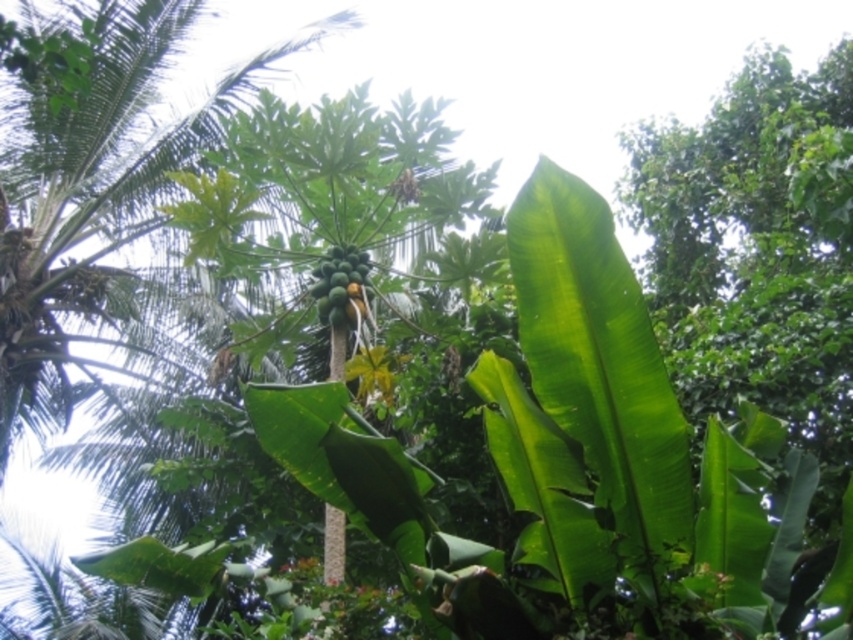
Between green matte coconut tree at center and green matte papaya at center, which one is positioned lower?

green matte papaya at center

Is green matte coconut tree at center shorter than green matte papaya at center?

Indeed, green matte coconut tree at center has a lesser height compared to green matte papaya at center.

Locate an element on the screen. The image size is (853, 640). green matte coconut tree at center is located at coordinates (323, 179).

Is point (120, 29) less distant than point (346, 275)?

No, it is behind (346, 275).

Is green leafy palm tree at center bigger than green matte papaya at center?

Correct, green leafy palm tree at center is larger in size than green matte papaya at center.

This screenshot has height=640, width=853. Describe the element at coordinates (97, 204) in the screenshot. I see `green leafy palm tree at center` at that location.

This screenshot has width=853, height=640. What are the coordinates of `green leafy palm tree at center` in the screenshot? It's located at (97, 204).

Image resolution: width=853 pixels, height=640 pixels. Describe the element at coordinates (97, 204) in the screenshot. I see `green leafy palm tree at center` at that location.

Does point (238, 88) lie in front of point (303, 396)?

No, it is not.

At what (x,y) coordinates should I click in order to perform the action: click on green leafy palm tree at center. Please return your answer as a coordinate pair (x, y). The height and width of the screenshot is (640, 853). Looking at the image, I should click on (97, 204).